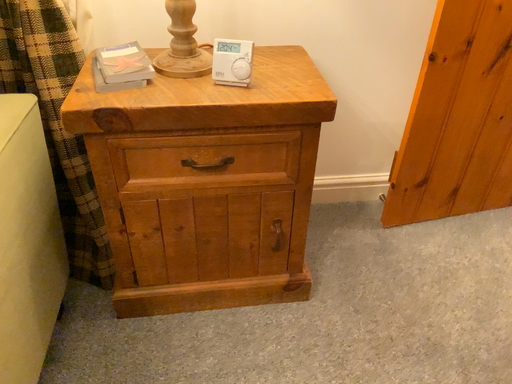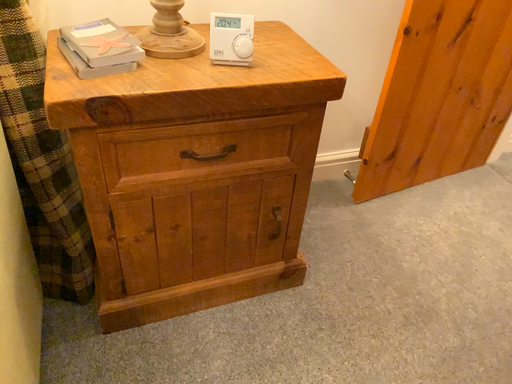
Question: Which way did the camera rotate in the video?

Choices:
 (A) rotated left
 (B) rotated right

Answer: (B)